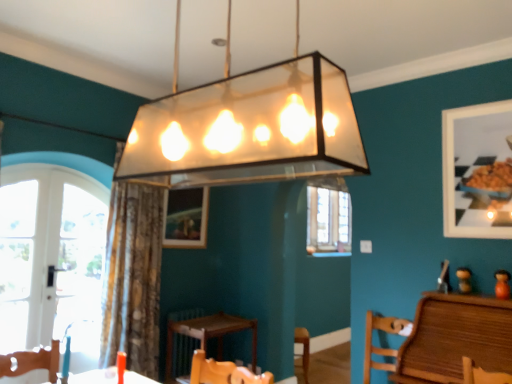
Question: Considering the relative sizes of matte white picture frame at upper right, positioned as the 2th picture frame in back-to-front order, and translucent glass pendant light at center in the image provided, is matte white picture frame at upper right, positioned as the 2th picture frame in back-to-front order, taller than translucent glass pendant light at center?

Choices:
 (A) yes
 (B) no

Answer: (A)

Question: Is matte white picture frame at upper right, the second picture frame positioned from the left, closer to the viewer compared to translucent glass pendant light at center?

Choices:
 (A) yes
 (B) no

Answer: (B)

Question: Is matte white picture frame at upper right, acting as the first picture frame starting from the front, touching translucent glass pendant light at center?

Choices:
 (A) yes
 (B) no

Answer: (B)

Question: Considering the relative sizes of matte white picture frame at upper right, arranged as the first picture frame when viewed from the right, and translucent glass pendant light at center in the image provided, is matte white picture frame at upper right, arranged as the first picture frame when viewed from the right, thinner than translucent glass pendant light at center?

Choices:
 (A) no
 (B) yes

Answer: (B)

Question: From the image's perspective, is matte white picture frame at upper right, arranged as the first picture frame when viewed from the right, above translucent glass pendant light at center?

Choices:
 (A) no
 (B) yes

Answer: (A)

Question: Is matte white picture frame at upper right, acting as the first picture frame starting from the front, turned away from translucent glass pendant light at center?

Choices:
 (A) yes
 (B) no

Answer: (B)

Question: From a real-world perspective, does brown textured curtain at center sit lower than wooden chair at lower right?

Choices:
 (A) no
 (B) yes

Answer: (A)

Question: Is brown textured curtain at center closer to the viewer compared to wooden chair at lower right?

Choices:
 (A) yes
 (B) no

Answer: (B)

Question: Is brown textured curtain at center next to wooden chair at lower right and touching it?

Choices:
 (A) yes
 (B) no

Answer: (B)

Question: Is brown textured curtain at center thinner than wooden chair at lower right?

Choices:
 (A) no
 (B) yes

Answer: (A)

Question: Is brown textured curtain at center facing towards wooden chair at lower right?

Choices:
 (A) no
 (B) yes

Answer: (A)

Question: Is brown textured curtain at center further to camera compared to wooden chair at lower right?

Choices:
 (A) yes
 (B) no

Answer: (A)

Question: Is brown textured curtain at center far from wooden picture frame at center, which is counted as the 1th picture frame, starting from the back?

Choices:
 (A) yes
 (B) no

Answer: (B)